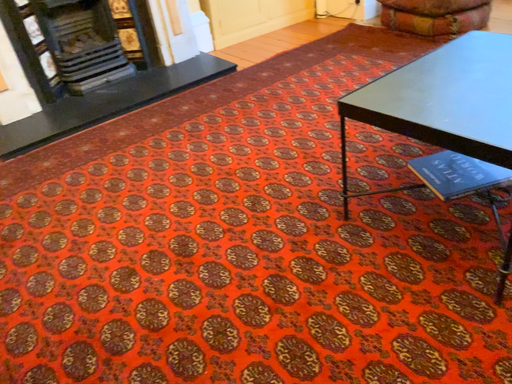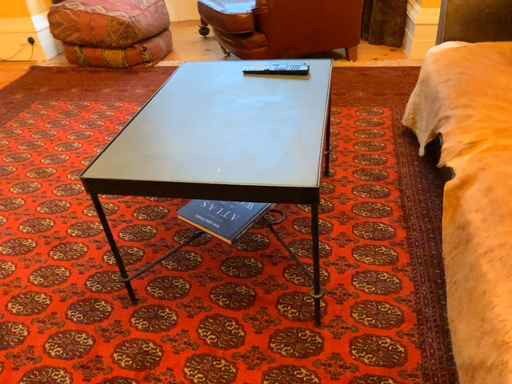
Question: How did the camera likely rotate when shooting the video?

Choices:
 (A) rotated right
 (B) rotated left

Answer: (A)